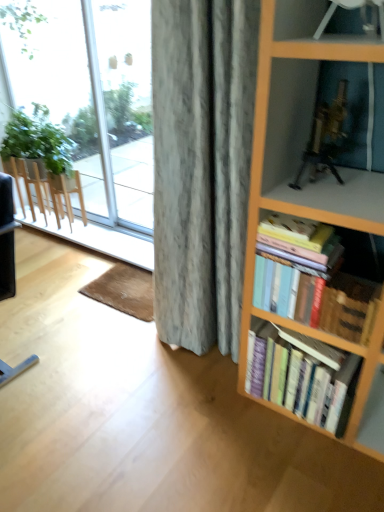
The height and width of the screenshot is (512, 384). Identify the location of vacant area to the left of hardcover books at right, the 1th book when ordered from bottom to top. (223, 404).